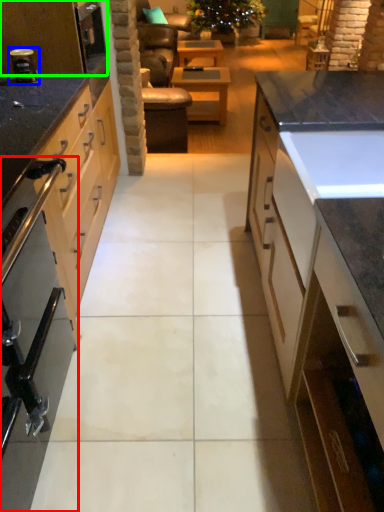
Question: Estimate the real-world distances between objects in this image. Which object is farther from home appliance (highlighted by a red box), appliance (highlighted by a blue box) or kitchen appliance (highlighted by a green box)?

Choices:
 (A) appliance
 (B) kitchen appliance

Answer: (B)